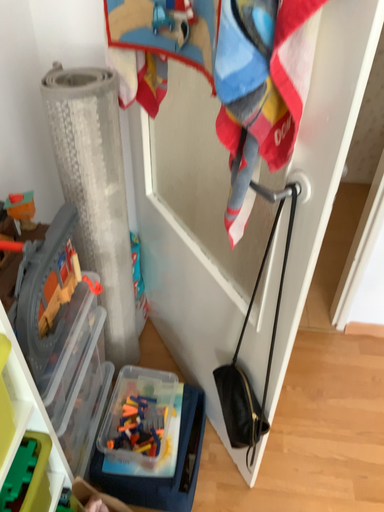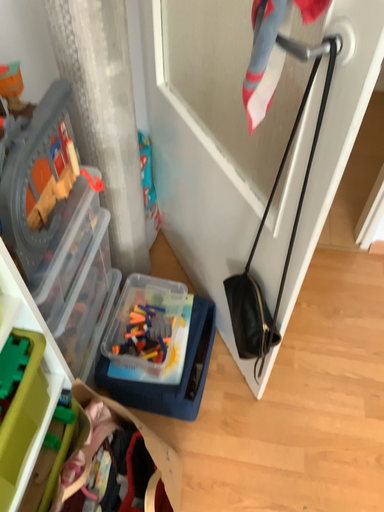
Question: Which way did the camera rotate in the video?

Choices:
 (A) rotated downward
 (B) rotated upward

Answer: (A)